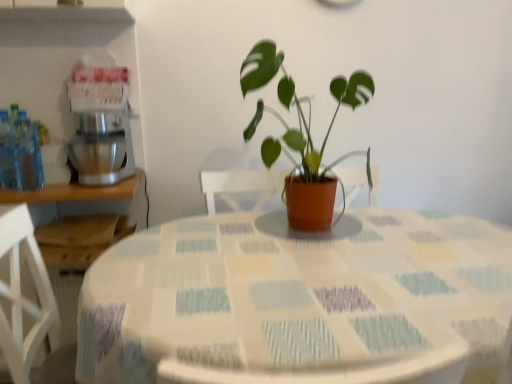
What do you see at coordinates (101, 149) in the screenshot?
I see `silver metallic mixer at left` at bounding box center [101, 149].

At what (x,y) coordinates should I click in order to perform the action: click on silver metallic mixer at left. Please return your answer as a coordinate pair (x, y). This screenshot has height=384, width=512. Looking at the image, I should click on (101, 149).

I want to click on silver metallic mixer at left, so [101, 149].

Is textured fabric tablecloth at center aimed at matte terracotta pot at center?

No, textured fabric tablecloth at center is not facing towards matte terracotta pot at center.

Who is smaller, textured fabric tablecloth at center or matte terracotta pot at center?

Smaller between the two is matte terracotta pot at center.

Is textured fabric tablecloth at center not close to matte terracotta pot at center?

No, textured fabric tablecloth at center is not far from matte terracotta pot at center.

Looking at this image, from the image's perspective, is textured fabric tablecloth at center on top of matte terracotta pot at center?

Actually, textured fabric tablecloth at center appears below matte terracotta pot at center in the image.

What's the angular difference between silver metallic mixer at left and textured fabric tablecloth at center's facing directions?

The facing directions of silver metallic mixer at left and textured fabric tablecloth at center are 1.62 degrees apart.

From a real-world perspective, between silver metallic mixer at left and textured fabric tablecloth at center, who is vertically lower?

textured fabric tablecloth at center, from a real-world perspective.

Can you confirm if silver metallic mixer at left is wider than textured fabric tablecloth at center?

In fact, silver metallic mixer at left might be narrower than textured fabric tablecloth at center.

Which object is positioned more to the left, silver metallic mixer at left or textured fabric tablecloth at center?

silver metallic mixer at left is more to the left.

From the image's perspective, which is above, textured fabric tablecloth at center or silver metallic mixer at left?

From the image's view, silver metallic mixer at left is above.

What's the angular difference between textured fabric tablecloth at center and silver metallic mixer at left's facing directions?

1.62 degrees.

From a real-world perspective, is textured fabric tablecloth at center under silver metallic mixer at left?

Yes, from a real-world perspective, textured fabric tablecloth at center is below silver metallic mixer at left.

Measure the distance between textured fabric tablecloth at center and silver metallic mixer at left.

33.49 inches.

Considering the positions of objects matte terracotta pot at center and textured fabric tablecloth at center in the image provided, who is behind, matte terracotta pot at center or textured fabric tablecloth at center?

matte terracotta pot at center.

Is textured fabric tablecloth at center a part of matte terracotta pot at center?

That's incorrect, textured fabric tablecloth at center is not inside matte terracotta pot at center.

Is matte terracotta pot at center aimed at textured fabric tablecloth at center?

No, matte terracotta pot at center is not oriented towards textured fabric tablecloth at center.

From a real-world perspective, who is located lower, matte terracotta pot at center or textured fabric tablecloth at center?

textured fabric tablecloth at center, from a real-world perspective.

Is silver metallic mixer at left shorter than matte terracotta pot at center?

Yes, silver metallic mixer at left is shorter than matte terracotta pot at center.

From a real-world perspective, is silver metallic mixer at left positioned above or below matte terracotta pot at center?

In terms of real-world spatial position, silver metallic mixer at left is below matte terracotta pot at center.

From the image's perspective, would you say silver metallic mixer at left is positioned over matte terracotta pot at center?

No, from the image's perspective, silver metallic mixer at left is not above matte terracotta pot at center.

Who is more distant, matte terracotta pot at center or silver metallic mixer at left?

silver metallic mixer at left.

Based on the photo, is matte terracotta pot at center shorter than silver metallic mixer at left?

Incorrect, the height of matte terracotta pot at center does not fall short of that of silver metallic mixer at left.

From the image's perspective, is matte terracotta pot at center located above silver metallic mixer at left?

Indeed, from the image's perspective, matte terracotta pot at center is shown above silver metallic mixer at left.

What are the coordinates of `houseplant above the textured fabric tablecloth at center (from a real-world perspective)` in the screenshot? It's located at (306, 137).

Locate an element on the screen. Image resolution: width=512 pixels, height=384 pixels. mixer located behind the textured fabric tablecloth at center is located at coordinates (101, 149).

Considering their positions, is silver metallic mixer at left positioned further to textured fabric tablecloth at center than matte terracotta pot at center?

silver metallic mixer at left lies further to textured fabric tablecloth at center than the other object.

Looking at the image, which one is located closer to silver metallic mixer at left, textured fabric tablecloth at center or matte terracotta pot at center?

matte terracotta pot at center is closer to silver metallic mixer at left.

From the image, which object appears to be nearer to matte terracotta pot at center, textured fabric tablecloth at center or silver metallic mixer at left?

textured fabric tablecloth at center is positioned closer to the anchor matte terracotta pot at center.

Which object lies nearer to the anchor point matte terracotta pot at center, silver metallic mixer at left or textured fabric tablecloth at center?

Among the two, textured fabric tablecloth at center is located nearer to matte terracotta pot at center.

When comparing their distances from textured fabric tablecloth at center, does matte terracotta pot at center or silver metallic mixer at left seem further?

Based on the image, silver metallic mixer at left appears to be further to textured fabric tablecloth at center.

Considering their positions, is matte terracotta pot at center positioned closer to silver metallic mixer at left than textured fabric tablecloth at center?

Among the two, matte terracotta pot at center is located nearer to silver metallic mixer at left.

Find the location of `houseplant between silver metallic mixer at left and textured fabric tablecloth at center`. houseplant between silver metallic mixer at left and textured fabric tablecloth at center is located at coordinates tap(306, 137).